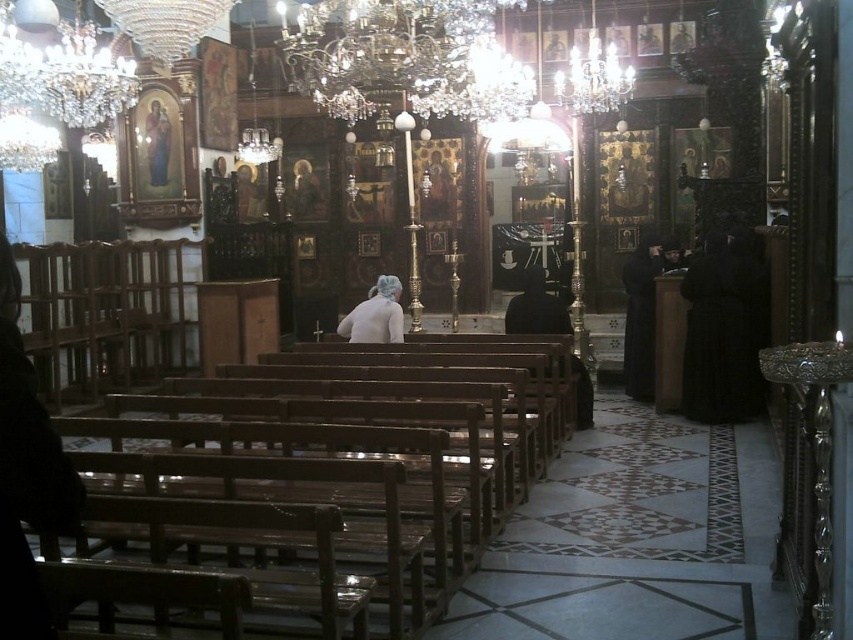
Question: Is crystal glass chandelier at upper center positioned before white matte hair at center?

Choices:
 (A) yes
 (B) no

Answer: (A)

Question: Observing the image, what is the correct spatial positioning of crystal glass chandelier at upper center in reference to matte gold icon at upper left?

Choices:
 (A) above
 (B) below

Answer: (A)

Question: Based on their relative distances, which object is nearer to the black velvet robe at center?

Choices:
 (A) matte gold icon at upper left
 (B) black matte robe at center
 (C) white matte hair at center

Answer: (C)

Question: Which of the following is the closest to the observer?

Choices:
 (A) white matte hair at center
 (B) matte gold icon at upper left
 (C) crystal glass chandelier at upper center

Answer: (C)

Question: Does black velvet robe at center have a greater width compared to matte gold icon at upper left?

Choices:
 (A) yes
 (B) no

Answer: (A)

Question: Which of the following is the farthest from the observer?

Choices:
 (A) crystal glass chandelier at upper center
 (B) white matte hair at center
 (C) black matte robe at center
 (D) matte gold icon at upper left

Answer: (D)